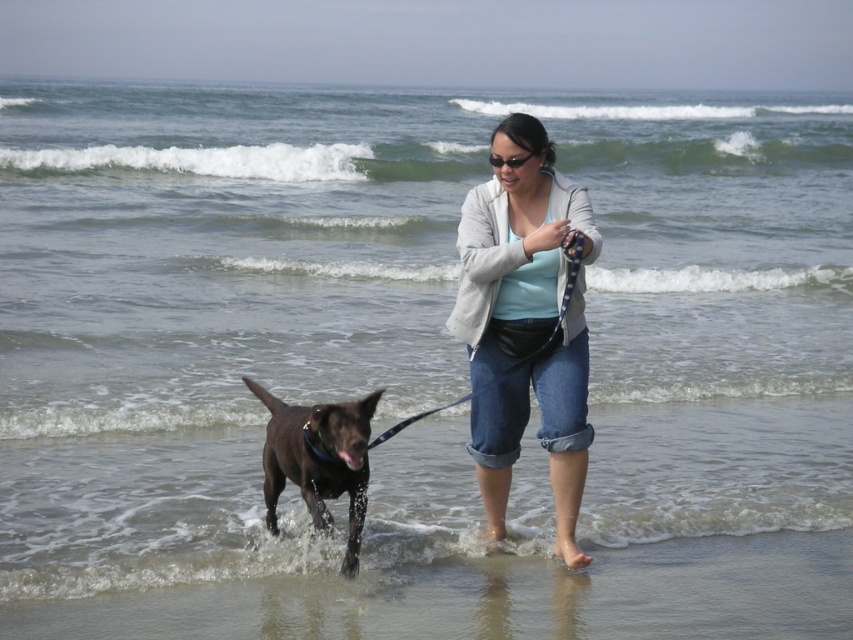
Which is more to the right, light gray textured jacket at center or blue fabric leash at center?

light gray textured jacket at center

Is light gray textured jacket at center shorter than blue fabric leash at center?

In fact, light gray textured jacket at center may be taller than blue fabric leash at center.

I want to click on light gray textured jacket at center, so click(515, 248).

Image resolution: width=853 pixels, height=640 pixels. What are the coordinates of `light gray textured jacket at center` in the screenshot? It's located at (515, 248).

Consider the image. Who is higher up, sandy beach at lower center or blue fabric leash at center?

blue fabric leash at center is above.

Is sandy beach at lower center smaller than blue fabric leash at center?

Result: Actually, sandy beach at lower center might be larger than blue fabric leash at center.

Locate an element on the screen. This screenshot has width=853, height=640. sandy beach at lower center is located at coordinates (497, 596).

Can you confirm if sandy beach at lower center is smaller than shiny brown dog at lower left?

No.

Is sandy beach at lower center bigger than shiny brown dog at lower left?

Indeed, sandy beach at lower center has a larger size compared to shiny brown dog at lower left.

Does point (683, 625) lie in front of point (331, 484)?

No, it is not.

Locate an element on the screen. sandy beach at lower center is located at coordinates (497, 596).